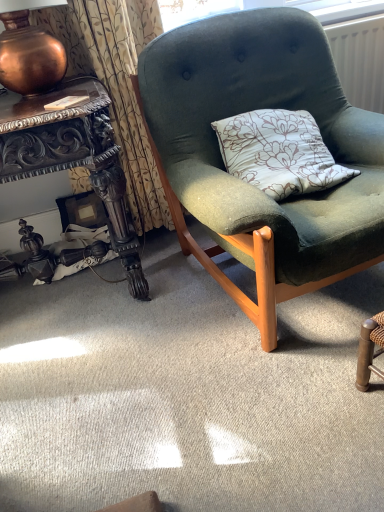
Question: Does point (175, 152) appear closer or farther from the camera than point (36, 54)?

Choices:
 (A) farther
 (B) closer

Answer: (A)

Question: Considering their positions, is velvet green chair at center located in front of or behind copper metallic lamp at upper left?

Choices:
 (A) behind
 (B) front

Answer: (B)

Question: Which object is the closest to the textured beige curtain at upper left?

Choices:
 (A) velvet green chair at center
 (B) polished dark wood desk at left
 (C) copper metallic lamp at upper left
 (D) white plastic radiator at upper right

Answer: (B)

Question: Based on their relative distances, which object is farther from the velvet green chair at center?

Choices:
 (A) copper metallic lamp at upper left
 (B) white plastic radiator at upper right
 (C) polished dark wood desk at left
 (D) textured beige curtain at upper left

Answer: (B)